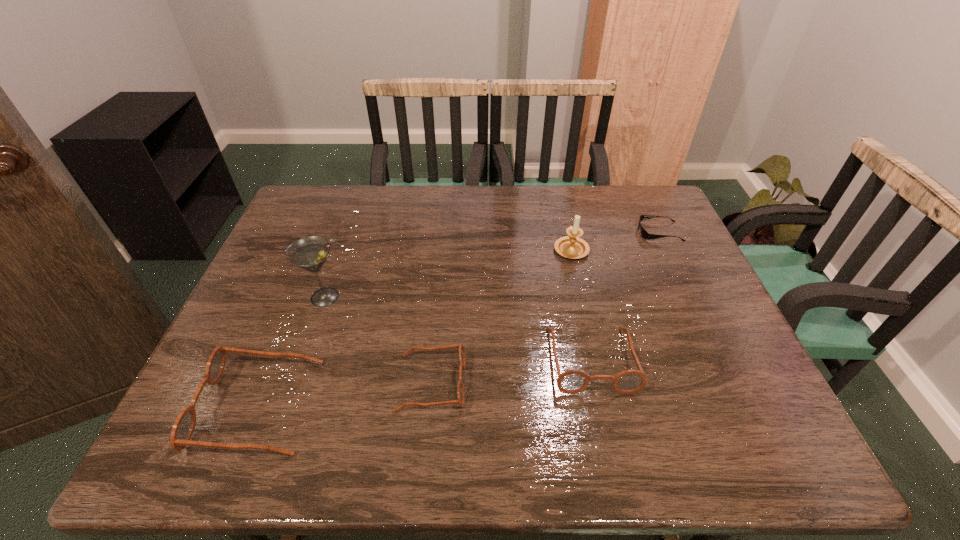
Find the location of a particular element. The width and height of the screenshot is (960, 540). free space between the third farthest object and the rightmost spectacles is located at coordinates (458, 328).

I want to click on object that is the closest to the tallest object, so click(183, 428).

Identify the location of object that ranks as the fifth closest to the third tallest object. (644, 233).

Identify the location of the closest spectacles relative to the second spectacles from right to left. This screenshot has width=960, height=540. (183, 428).

Image resolution: width=960 pixels, height=540 pixels. I want to click on spectacles that is the nearest to the second tallest object, so click(x=571, y=381).

Where is `free space that satisfies the following two spatial constraints: 1. on the front-facing side of the third shortest object; 2. on the front-facing side of the second spectacles from right to left`? Image resolution: width=960 pixels, height=540 pixels. free space that satisfies the following two spatial constraints: 1. on the front-facing side of the third shortest object; 2. on the front-facing side of the second spectacles from right to left is located at coordinates [596, 382].

At what (x,y) coordinates should I click in order to perform the action: click on free space in the image that satisfies the following two spatial constraints: 1. on the front-facing side of the fourth tallest object; 2. on the front-facing side of the fourth shortest object. Please return your answer as a coordinate pair (x, y). Image resolution: width=960 pixels, height=540 pixels. Looking at the image, I should click on (601, 407).

Where is `free space that satisfies the following two spatial constraints: 1. on the front-facing side of the rightmost object; 2. on the front-facing side of the second shortest spectacles`? This screenshot has height=540, width=960. free space that satisfies the following two spatial constraints: 1. on the front-facing side of the rightmost object; 2. on the front-facing side of the second shortest spectacles is located at coordinates point(720,360).